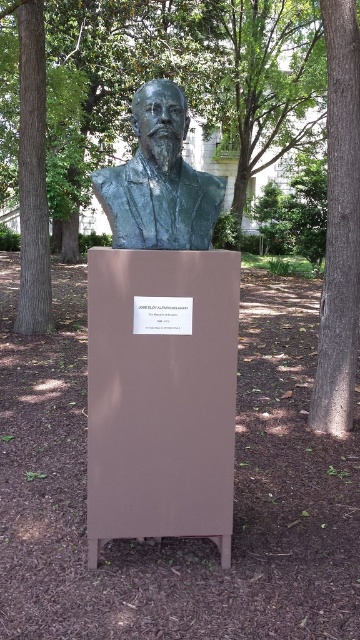
Who is shorter, bronze bust at center or brown textured tree at left?

Standing shorter between the two is bronze bust at center.

Between bronze bust at center and brown textured tree at left, which one is positioned lower?

bronze bust at center

Find the location of a particular element. The height and width of the screenshot is (640, 360). bronze bust at center is located at coordinates (159, 180).

Where is `bronze bust at center`? The width and height of the screenshot is (360, 640). bronze bust at center is located at coordinates (159, 180).

Who is more distant from viewer, (x=304, y=131) or (x=23, y=77)?

Point (x=304, y=131)

Image resolution: width=360 pixels, height=640 pixels. Find the location of `brown wood tree at center`. brown wood tree at center is located at coordinates (339, 221).

Locate an element on the screen. The height and width of the screenshot is (640, 360). brown wood tree at center is located at coordinates (339, 221).

Between smooth brown bark at right and bronze bust at center, which one has more height?

smooth brown bark at right

Measure the distance between smooth brown bark at right and bronze bust at center.

They are 6.87 feet apart.

Does point (335, 45) come farther from viewer compared to point (128, 196)?

Yes, it is.

The image size is (360, 640). In order to click on smooth brown bark at right in this screenshot , I will do `click(339, 225)`.